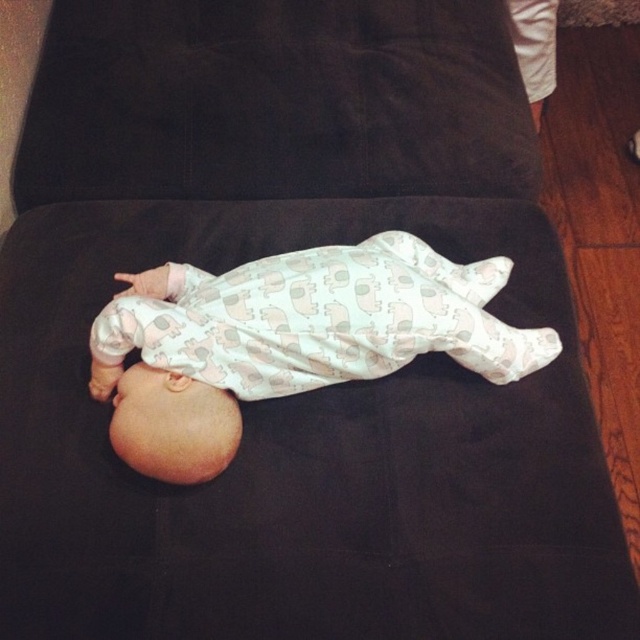
You are a photographer setting up a shoot for a baby product catalog. You need to ensure that the black suede pillow at center and the white printed fabric baby at center are framed properly. Based on their sizes, which object should be placed closer to the camera to maintain a balanced composition?

The black suede pillow at center is taller than the white printed fabric baby at center. To maintain a balanced composition, the white printed fabric baby at center should be placed closer to the camera so that its apparent size matches the pillow.

You are a photographer setting up a shoot for a baby product catalog. You need to position the white printed fabric baby at center so that it is wider than the black suede pillow at center. Can you adjust the baby to meet this requirement?

The black suede pillow at center is currently wider than the white printed fabric baby at center. To make the baby wider than the pillow, you would need to adjust the baby or choose a different pillow with a smaller width.